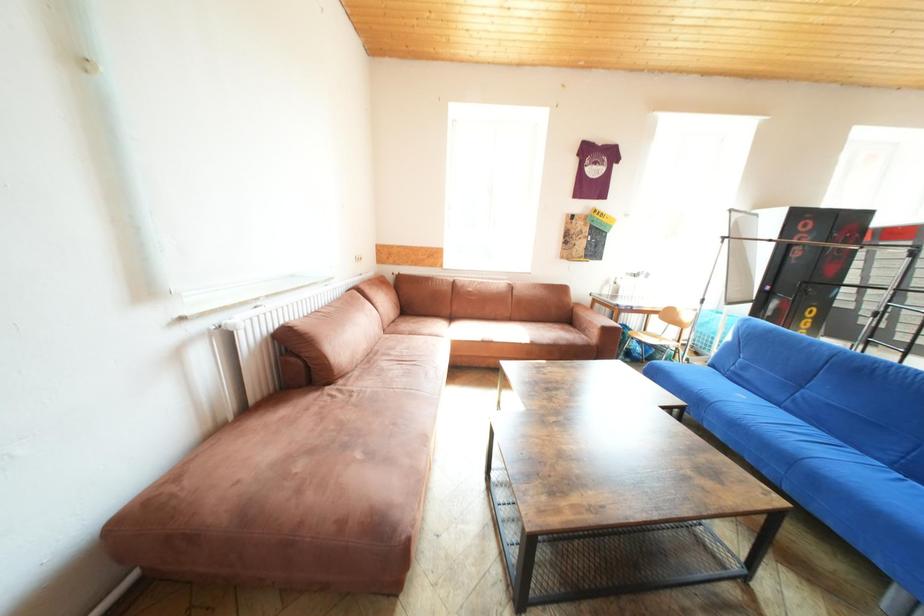
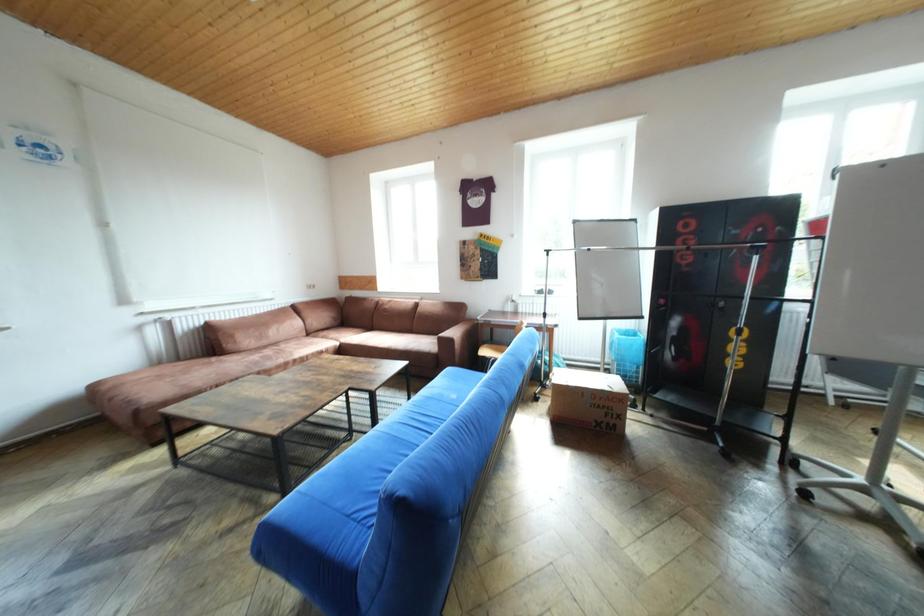
Question: The images are taken continuously from a first-person perspective. In which direction are you moving?

Choices:
 (A) Left
 (B) Right
 (C) Forward
 (D) Backward

Answer: (B)